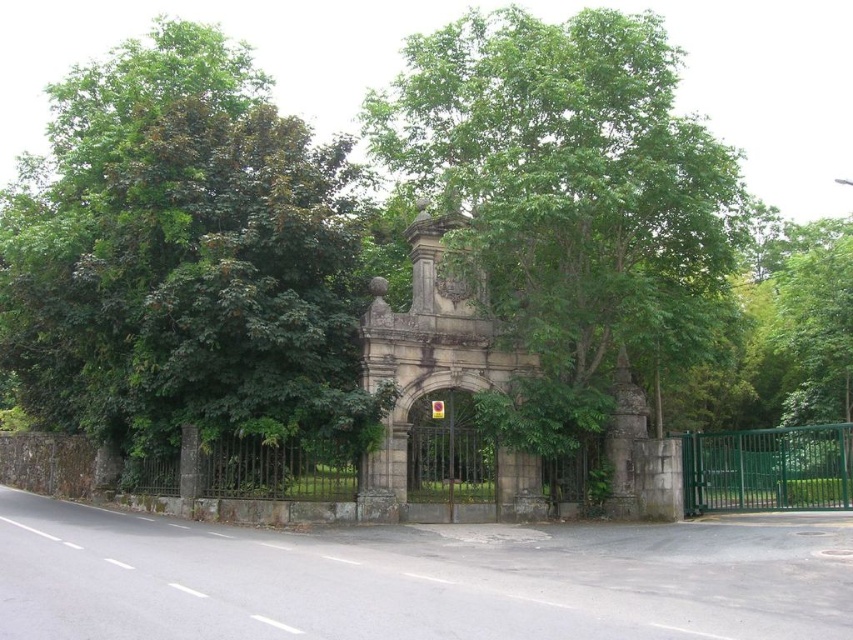
Question: Is green leafy tree at center positioned before green metallic gate at center?

Choices:
 (A) yes
 (B) no

Answer: (A)

Question: Which point is farther to the camera?

Choices:
 (A) (808, 468)
 (B) (363, 413)
 (C) (474, 461)
 (D) (622, 83)

Answer: (C)

Question: Which is farther from the stone archway at center?

Choices:
 (A) green metallic gate at center
 (B) green leafy tree at left
 (C) green leafy tree at center

Answer: (A)

Question: Where is green leafy tree at left located in relation to green metallic gate at center in the image?

Choices:
 (A) below
 (B) above

Answer: (B)

Question: Does green leafy tree at center have a larger size compared to stone archway at center?

Choices:
 (A) no
 (B) yes

Answer: (B)

Question: Which point is farther to the camera?

Choices:
 (A) (726, 451)
 (B) (273, 170)
 (C) (389, 166)
 (D) (421, 404)

Answer: (C)